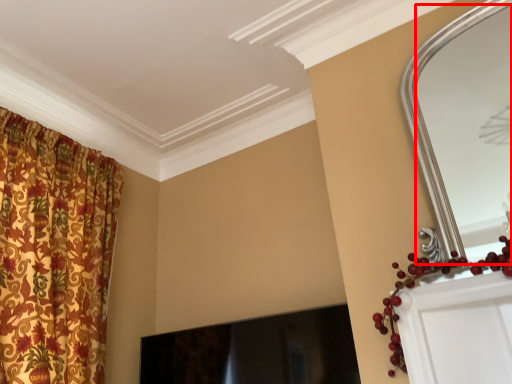
Question: From the image's perspective, what is the correct spatial relationship of mirror (annotated by the red box) in relation to fireplace?

Choices:
 (A) below
 (B) above

Answer: (B)